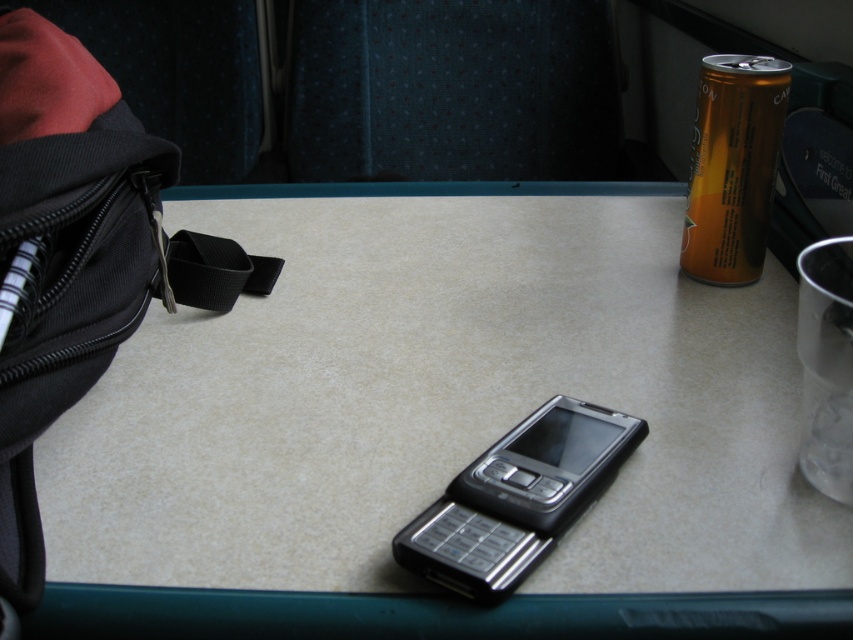
You are a traveler who needs to place your black fabric bag at left and orange aluminum can at upper right into a small storage compartment that can only accommodate items narrower than 20 cm. Based on their widths, can both items fit?

The black fabric bag at left might be wider than orange aluminum can at upper right. Since the storage compartment requires items narrower than 20 cm, we cannot confirm if both will fit without knowing the exact width of the bag.

You are sitting at the table and want to place a small item into the black fabric bag at left. Where should you move the item to?

You should move the item to the location at point (78, 257) where the black fabric bag at left is located.

You are sitting at the table and want to pick up the matte plastic phone at center and the silver metallic smartphone at center. Which one do you need to reach over first?

You need to reach over the matte plastic phone at center first because it is closer to you than the silver metallic smartphone at center, so you would reach it first before accessing the smartphone.